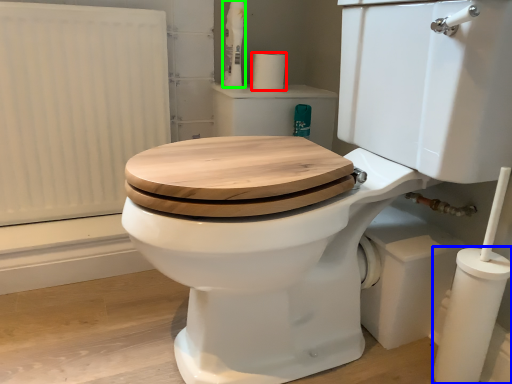
Question: Which is farther away from toilet paper (highlighted by a red box)? pillar (highlighted by a blue box) or toiletry (highlighted by a green box)?

Choices:
 (A) pillar
 (B) toiletry

Answer: (A)